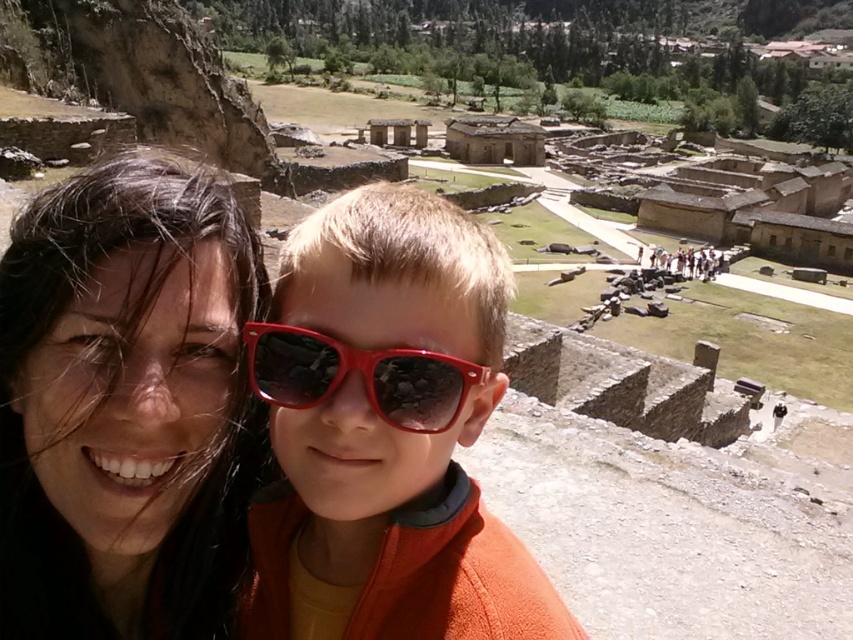
Is matte black hair at upper left below matte plastic sunglasses at center?

No.

The width and height of the screenshot is (853, 640). Find the location of `matte black hair at upper left`. matte black hair at upper left is located at coordinates (125, 403).

Locate an element on the screen. This screenshot has height=640, width=853. matte black hair at upper left is located at coordinates (125, 403).

Who is positioned more to the right, matte plastic sunglasses at center or shiny plastic goggles at center?

matte plastic sunglasses at center

Which is above, matte plastic sunglasses at center or shiny plastic goggles at center?

shiny plastic goggles at center

Image resolution: width=853 pixels, height=640 pixels. I want to click on matte plastic sunglasses at center, so click(386, 433).

This screenshot has height=640, width=853. I want to click on matte plastic sunglasses at center, so click(x=386, y=433).

Describe the element at coordinates (125, 403) in the screenshot. Image resolution: width=853 pixels, height=640 pixels. I see `matte black hair at upper left` at that location.

Is matte black hair at upper left thinner than shiny plastic goggles at center?

Incorrect, matte black hair at upper left's width is not less than shiny plastic goggles at center's.

Between point (51, 188) and point (422, 428), which one is positioned behind?

The point (422, 428) is more distant.

You are a GUI agent. You are given a task and a screenshot of the screen. Output one action in this format:
    pyautogui.click(x=<x>, y=<y>)
    Task: Click on the matte black hair at upper left
    
    Given the screenshot: What is the action you would take?
    [125, 403]